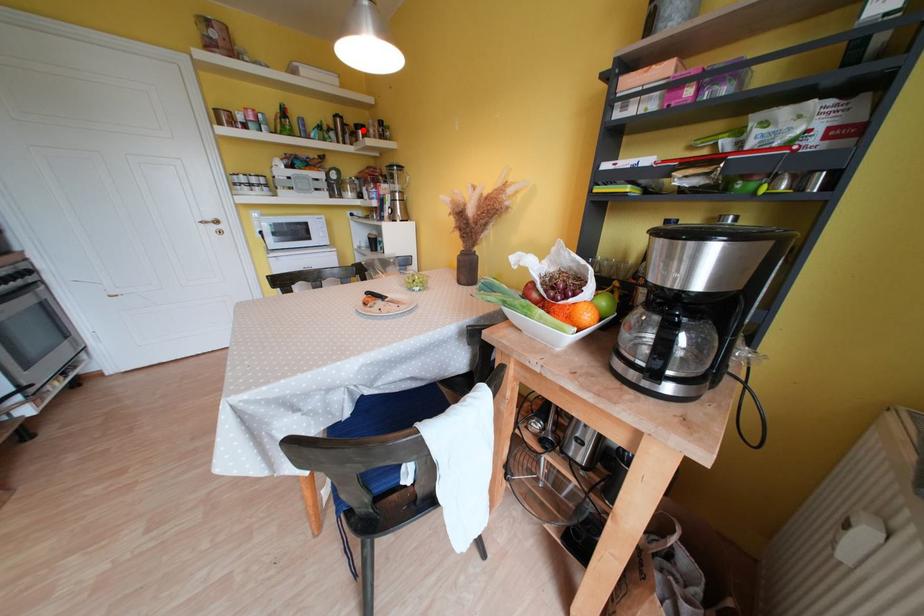
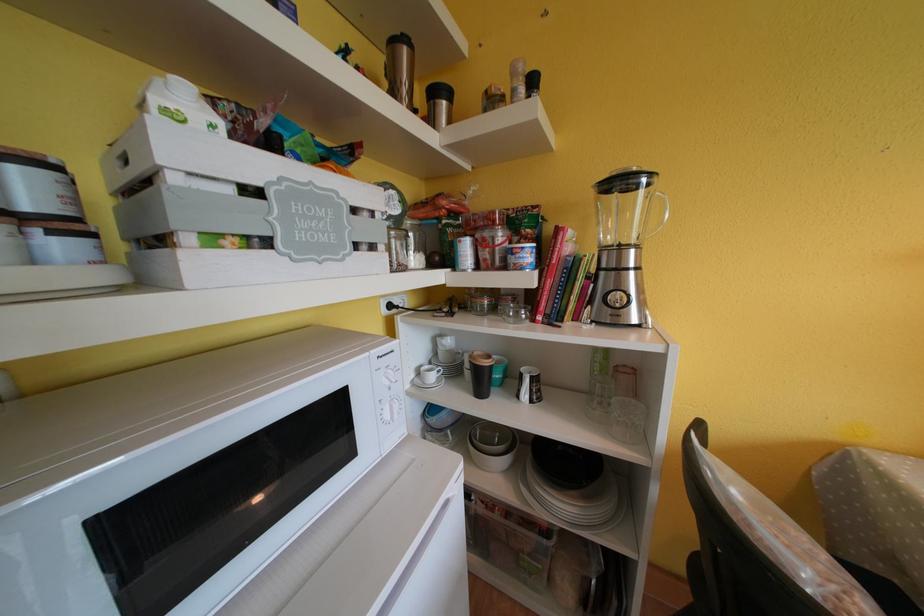
In the second image, find the point that corresponds to the highlighted location in the first image.

(440, 95)